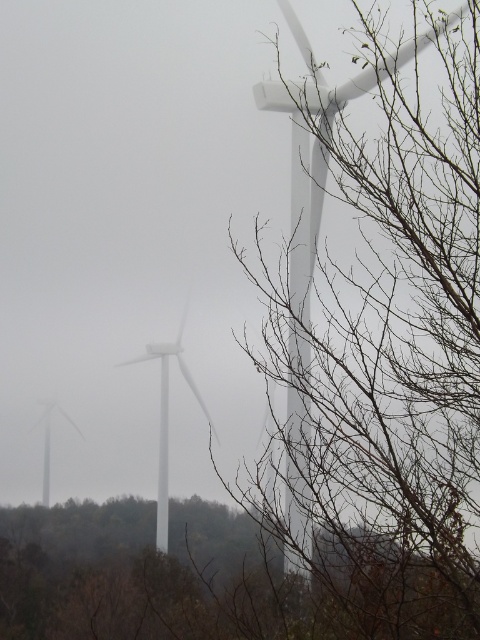
Question: Does bare branches at upper right appear under brown leafless branches at lower right?

Choices:
 (A) yes
 (B) no

Answer: (B)

Question: Is bare branches at upper right thinner than brown leafless branches at lower right?

Choices:
 (A) no
 (B) yes

Answer: (B)

Question: Does bare branches at upper right have a larger size compared to brown leafless branches at lower right?

Choices:
 (A) no
 (B) yes

Answer: (A)

Question: Among these points, which one is farthest from the camera?

Choices:
 (A) (336, 540)
 (B) (304, 104)

Answer: (B)